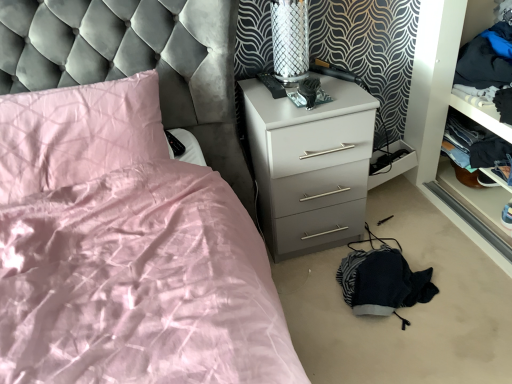
This screenshot has height=384, width=512. Describe the element at coordinates (290, 40) in the screenshot. I see `metallic mesh table lamp at upper right` at that location.

What is the approximate height of dark blue fabric at right, which is the 2th clothing in bottom-to-top order?

The height of dark blue fabric at right, which is the 2th clothing in bottom-to-top order, is 12.02 inches.

Find the location of `dark blue fabric at right, which ranks as the first clothing in top-to-bottom order`. dark blue fabric at right, which ranks as the first clothing in top-to-bottom order is located at coordinates (489, 66).

What do you see at coordinates (310, 165) in the screenshot?
I see `white glossy chest of drawers at center` at bounding box center [310, 165].

I want to click on dark blue fabric at right, which is the second clothing from top to bottom, so click(475, 141).

Where is `pink satin pillow at upper left`? The image size is (512, 384). pink satin pillow at upper left is located at coordinates (77, 134).

Where is `metallic mesh table lamp at upper right`? The image size is (512, 384). metallic mesh table lamp at upper right is located at coordinates (290, 40).

Is metallic mesh table lamp at upper right touching dark blue fabric at right, which ranks as the first clothing in top-to-bottom order?

No, metallic mesh table lamp at upper right is not next to dark blue fabric at right, which ranks as the first clothing in top-to-bottom order.

From the picture: Is metallic mesh table lamp at upper right oriented away from dark blue fabric at right, which ranks as the first clothing in top-to-bottom order?

No, metallic mesh table lamp at upper right's orientation is not away from dark blue fabric at right, which ranks as the first clothing in top-to-bottom order.

From the image's perspective, which one is positioned higher, metallic mesh table lamp at upper right or dark blue fabric at right, which is the 2th clothing in bottom-to-top order?

dark blue fabric at right, which is the 2th clothing in bottom-to-top order, from the image's perspective.

In terms of height, does metallic mesh table lamp at upper right look taller or shorter compared to dark blue fabric at right, which is the 2th clothing in bottom-to-top order?

In the image, metallic mesh table lamp at upper right appears to be taller than dark blue fabric at right, which is the 2th clothing in bottom-to-top order.

Between dark blue fabric at right, which is the 2th clothing in bottom-to-top order, and pink satin pillow at upper left, which one has less height?

pink satin pillow at upper left.

From the image's perspective, is dark blue fabric at right, which ranks as the first clothing in top-to-bottom order, located above or below pink satin pillow at upper left?

dark blue fabric at right, which ranks as the first clothing in top-to-bottom order, is above pink satin pillow at upper left.

Looking at this image, is dark blue fabric at right, which ranks as the first clothing in top-to-bottom order, positioned far away from pink satin pillow at upper left?

Yes.

Could you tell me if dark blue fabric at right, which is the 2th clothing in bottom-to-top order, is turned towards pink satin pillow at upper left?

Yes, dark blue fabric at right, which is the 2th clothing in bottom-to-top order, is turned towards pink satin pillow at upper left.

Is pink satin pillow at upper left spatially inside dark blue fabric at right, which ranks as the first clothing in top-to-bottom order, or outside of it?

pink satin pillow at upper left lies outside dark blue fabric at right, which ranks as the first clothing in top-to-bottom order.

From the image's perspective, would you say pink satin pillow at upper left is positioned over dark blue fabric at right, which is the 2th clothing in bottom-to-top order?

No.

How many degrees apart are the facing directions of pink satin pillow at upper left and dark blue fabric at right, which is the 2th clothing in bottom-to-top order?

The facing directions of pink satin pillow at upper left and dark blue fabric at right, which is the 2th clothing in bottom-to-top order, are 89.1 degrees apart.

Image resolution: width=512 pixels, height=384 pixels. I want to click on pillow in front of the dark blue fabric at right, which is the 2th clothing in bottom-to-top order, so click(77, 134).

Considering the points (448, 131) and (337, 231), which point is behind, point (448, 131) or point (337, 231)?

Point (448, 131)

Is dark blue fabric at right, which ranks as the 1th clothing in bottom-to-top order, thinner than white glossy chest of drawers at center?

Yes.

Considering the sizes of dark blue fabric at right, which ranks as the 1th clothing in bottom-to-top order, and white glossy chest of drawers at center in the image, is dark blue fabric at right, which ranks as the 1th clothing in bottom-to-top order, bigger or smaller than white glossy chest of drawers at center?

In the image, dark blue fabric at right, which ranks as the 1th clothing in bottom-to-top order, appears to be smaller than white glossy chest of drawers at center.

From the image's perspective, is dark blue fabric at right, which is the second clothing from top to bottom, located above or below white glossy chest of drawers at center?

dark blue fabric at right, which is the second clothing from top to bottom, is above white glossy chest of drawers at center.

Would you say white glossy chest of drawers at center is outside pink satin pillow at upper left?

Absolutely, white glossy chest of drawers at center is external to pink satin pillow at upper left.

How many degrees apart are the facing directions of white glossy chest of drawers at center and pink satin pillow at upper left?

0.651 degrees separate the facing orientations of white glossy chest of drawers at center and pink satin pillow at upper left.

From the image's perspective, which object appears higher, white glossy chest of drawers at center or pink satin pillow at upper left?

From the image's view, pink satin pillow at upper left is above.

Is white glossy chest of drawers at center turned away from pink satin pillow at upper left?

No, pink satin pillow at upper left is not at the back of white glossy chest of drawers at center.

Are pink satin pillow at upper left and metallic mesh table lamp at upper right beside each other?

No, pink satin pillow at upper left is not with metallic mesh table lamp at upper right.

This screenshot has width=512, height=384. What are the coordinates of `table lamp on the right of the pink satin pillow at upper left` in the screenshot? It's located at (290, 40).

Considering the sizes of pink satin pillow at upper left and metallic mesh table lamp at upper right in the image, is pink satin pillow at upper left wider or thinner than metallic mesh table lamp at upper right?

Considering their sizes, pink satin pillow at upper left looks broader than metallic mesh table lamp at upper right.

Consider the image. From the image's perspective, is pink satin pillow at upper left on metallic mesh table lamp at upper right?

Incorrect, from the image's perspective, pink satin pillow at upper left is lower than metallic mesh table lamp at upper right.

Could you tell me if metallic mesh table lamp at upper right is turned towards white glossy chest of drawers at center?

No, metallic mesh table lamp at upper right is not turned towards white glossy chest of drawers at center.

Does point (301, 17) lie behind point (277, 107)?

Yes, it is.

Is metallic mesh table lamp at upper right placed right next to white glossy chest of drawers at center?

No, metallic mesh table lamp at upper right is not next to white glossy chest of drawers at center.

How different are the orientations of metallic mesh table lamp at upper right and white glossy chest of drawers at center in degrees?

The facing directions of metallic mesh table lamp at upper right and white glossy chest of drawers at center are 3.35 degrees apart.

From the metallic mesh table lamp at upper right, count 1st clothing to the right and point to it. Please provide its 2D coordinates.

[(489, 66)]

From the image's perspective, count 2nd clothings upward from the pink satin pillow at upper left and point to it. Please provide its 2D coordinates.

[(489, 66)]

Based on their spatial positions, is dark blue fabric at right, which is the 2th clothing in bottom-to-top order, or white glossy chest of drawers at center closer to dark blue fabric at right, which is the second clothing from top to bottom?

Based on the image, dark blue fabric at right, which is the 2th clothing in bottom-to-top order, appears to be nearer to dark blue fabric at right, which is the second clothing from top to bottom.

When comparing their distances from white glossy chest of drawers at center, does metallic mesh table lamp at upper right or dark blue fabric at right, which is the 2th clothing in bottom-to-top order, seem closer?

The object closer to white glossy chest of drawers at center is metallic mesh table lamp at upper right.

Estimate the real-world distances between objects in this image. Which object is further from dark blue fabric at right, which ranks as the first clothing in top-to-bottom order, pink satin pillow at upper left or metallic mesh table lamp at upper right?

pink satin pillow at upper left lies further to dark blue fabric at right, which ranks as the first clothing in top-to-bottom order, than the other object.

Estimate the real-world distances between objects in this image. Which object is further from metallic mesh table lamp at upper right, dark blue fabric at right, which ranks as the 1th clothing in bottom-to-top order, or white glossy chest of drawers at center?

Among the two, dark blue fabric at right, which ranks as the 1th clothing in bottom-to-top order, is located further to metallic mesh table lamp at upper right.

Estimate the real-world distances between objects in this image. Which object is closer to metallic mesh table lamp at upper right, dark blue fabric at right, which is the 2th clothing in bottom-to-top order, or white glossy chest of drawers at center?

The object closer to metallic mesh table lamp at upper right is white glossy chest of drawers at center.

When comparing their distances from metallic mesh table lamp at upper right, does pink satin pillow at upper left or dark blue fabric at right, which is the 2th clothing in bottom-to-top order, seem further?

dark blue fabric at right, which is the 2th clothing in bottom-to-top order, is positioned further to the anchor metallic mesh table lamp at upper right.

Based on the photo, from the image, which object appears to be farther from pink satin pillow at upper left, dark blue fabric at right, which ranks as the first clothing in top-to-bottom order, or white glossy chest of drawers at center?

Based on the image, dark blue fabric at right, which ranks as the first clothing in top-to-bottom order, appears to be further to pink satin pillow at upper left.

Based on their spatial positions, is white glossy chest of drawers at center or dark blue fabric at right, which ranks as the first clothing in top-to-bottom order, further from pink satin pillow at upper left?

dark blue fabric at right, which ranks as the first clothing in top-to-bottom order, is positioned further to the anchor pink satin pillow at upper left.

You are a GUI agent. You are given a task and a screenshot of the screen. Output one action in this format:
    pyautogui.click(x=<x>, y=<y>)
    Task: Click on the table lamp located between pink satin pillow at upper left and dark blue fabric at right, which ranks as the first clothing in top-to-bottom order, in the left-right direction
    
    Given the screenshot: What is the action you would take?
    pyautogui.click(x=290, y=40)

Locate an element on the screen. This screenshot has width=512, height=384. the chest of drawers situated between pink satin pillow at upper left and dark blue fabric at right, which ranks as the 1th clothing in bottom-to-top order, from left to right is located at coordinates (310, 165).

Image resolution: width=512 pixels, height=384 pixels. In order to click on chest of drawers between metallic mesh table lamp at upper right and dark blue fabric at right, which ranks as the first clothing in top-to-bottom order, in the horizontal direction in this screenshot , I will do `click(310, 165)`.

Image resolution: width=512 pixels, height=384 pixels. I want to click on clothing between metallic mesh table lamp at upper right and dark blue fabric at right, which ranks as the 1th clothing in bottom-to-top order, so click(x=489, y=66).